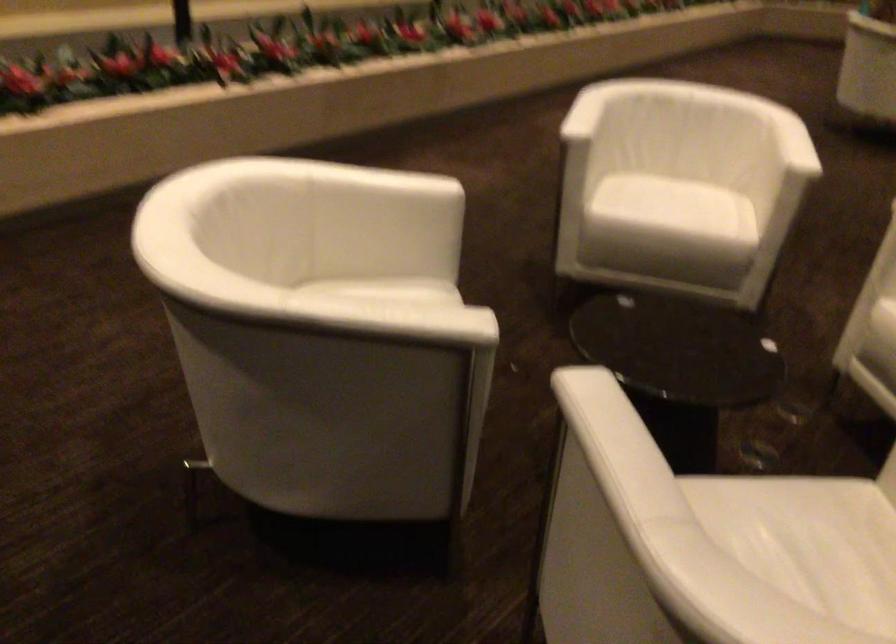
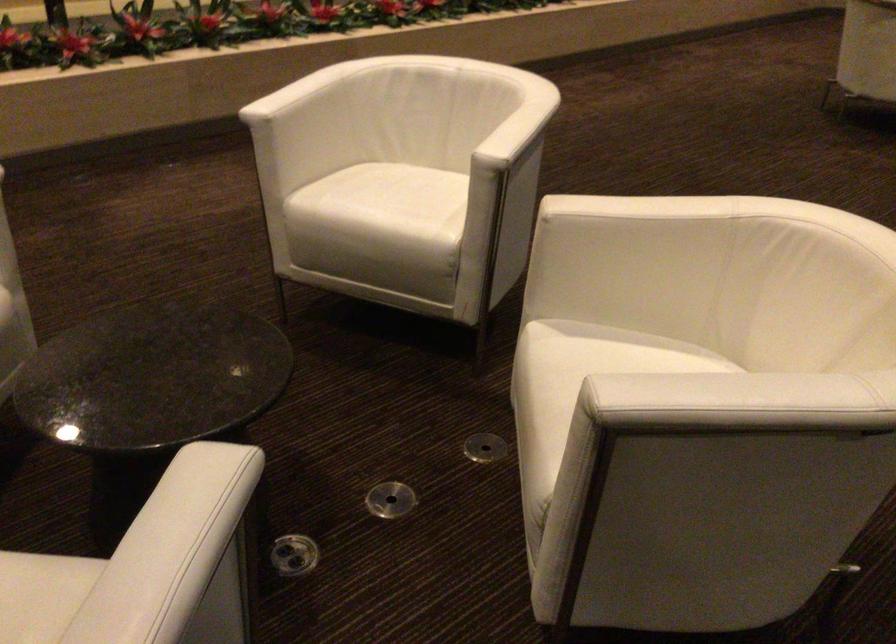
Find the pixel in the second image that matches (670,346) in the first image.

(152, 377)